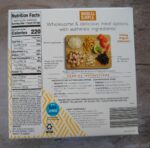
You are a GUI agent. You are given a task and a screenshot of the screen. Output one action in this format:
    pyautogui.click(x=<x>, y=<y>)
    Task: Click on the something orange on top right corner of cutting board
    The width and height of the screenshot is (150, 148).
    Given the screenshot: What is the action you would take?
    pyautogui.click(x=103, y=40)